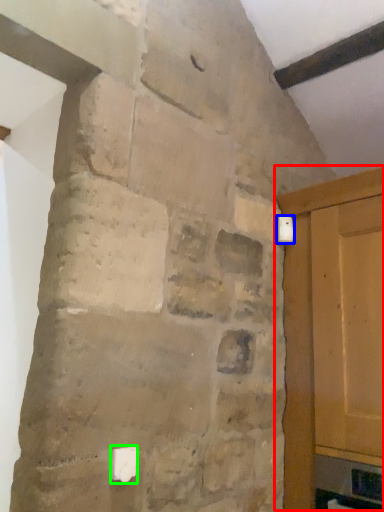
Question: Which is nearer to the door (highlighted by a red box)? light switch (highlighted by a blue box) or light switch (highlighted by a green box).

Choices:
 (A) light switch
 (B) light switch

Answer: (A)